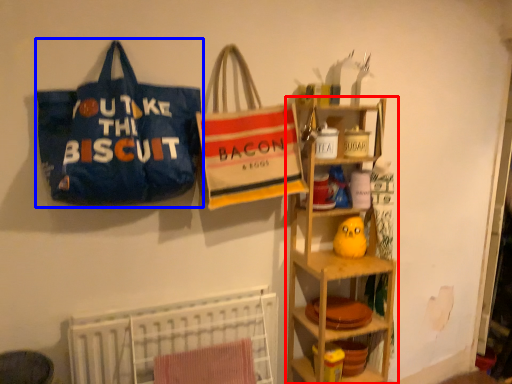
Question: Which object is closer to the camera taking this photo, shelf (highlighted by a red box) or handbag (highlighted by a blue box)?

Choices:
 (A) shelf
 (B) handbag

Answer: (B)